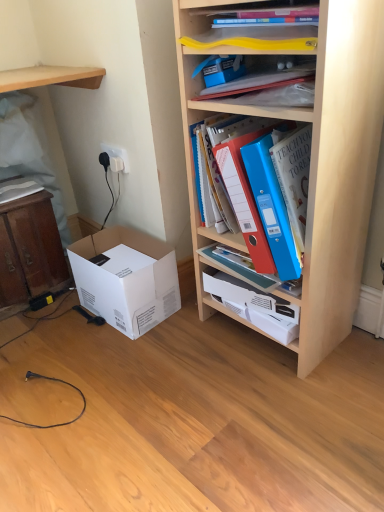
You are a GUI agent. You are given a task and a screenshot of the screen. Output one action in this format:
    pyautogui.click(x=<x>, y=<y>)
    Task: Click on the vacant area in front of wooden cabinet at left
    
    Given the screenshot: What is the action you would take?
    pyautogui.click(x=46, y=331)